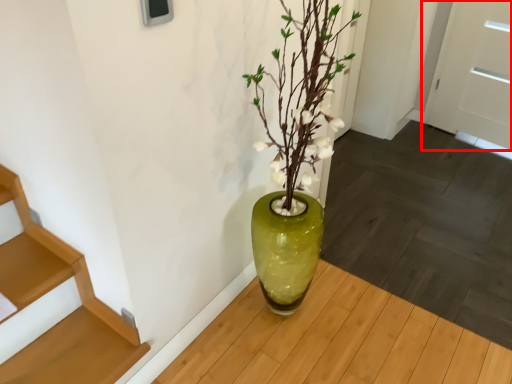
Question: From the image's perspective, what is the correct spatial relationship of door (annotated by the red box) in relation to stairs?

Choices:
 (A) above
 (B) below

Answer: (A)